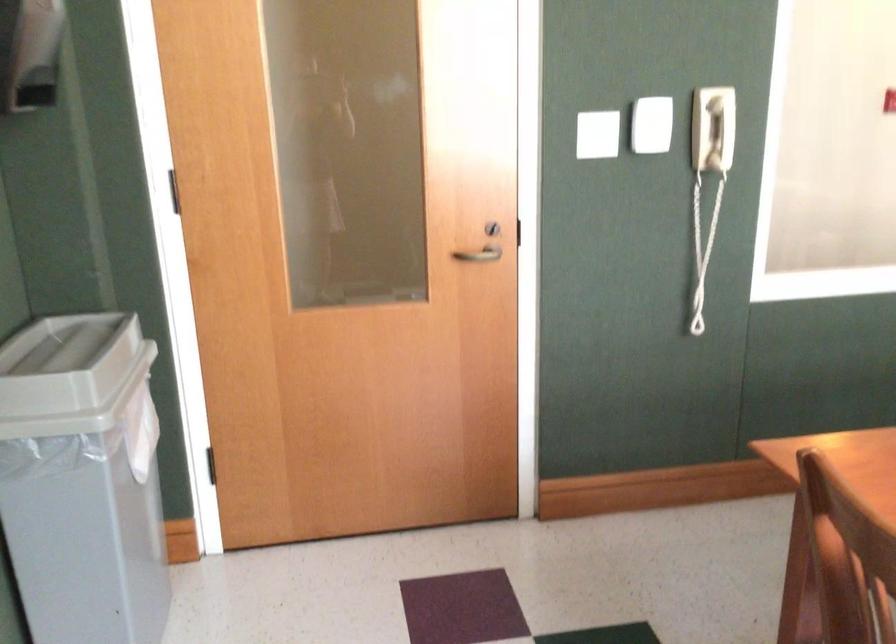
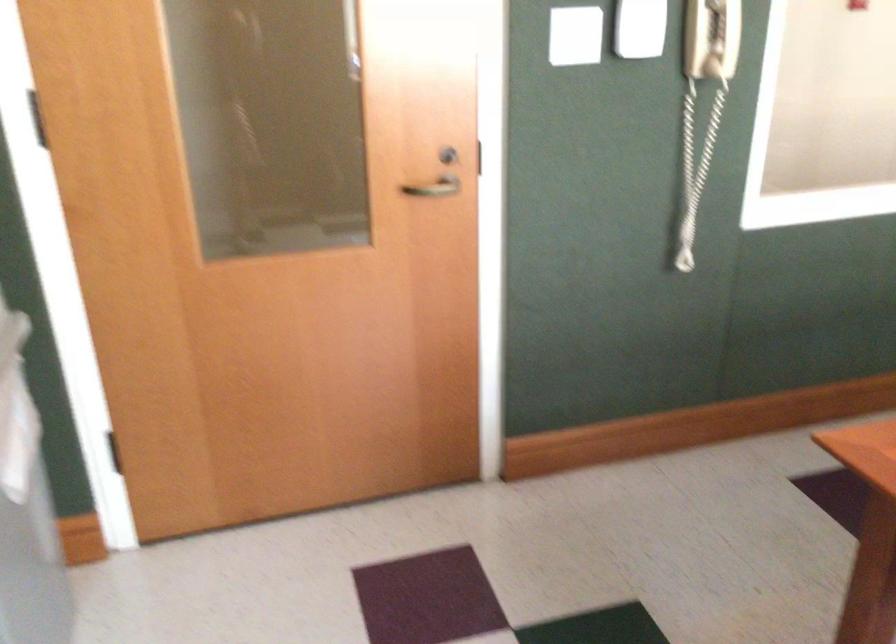
Question: How did the camera likely rotate?

Choices:
 (A) Left
 (B) Right
 (C) Up
 (D) Down

Answer: (D)